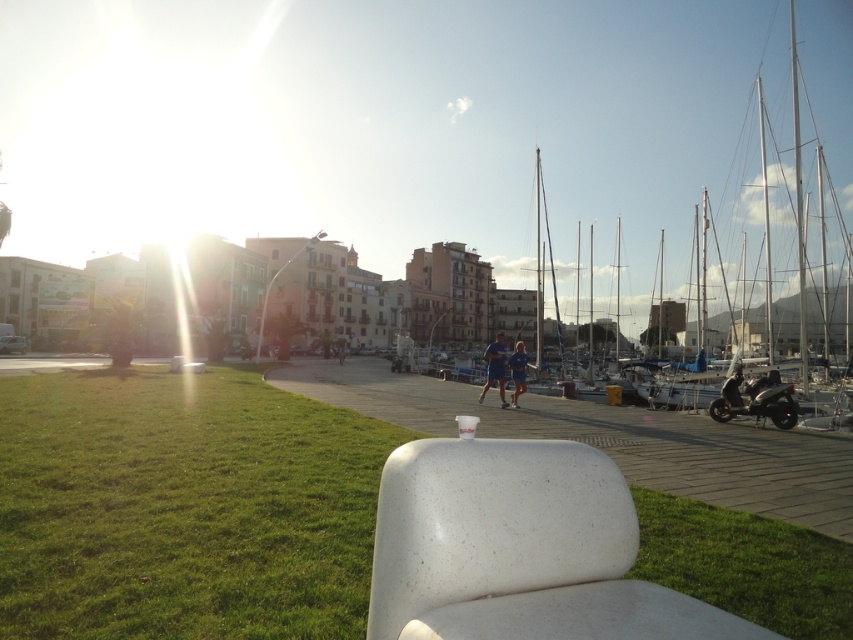
Question: Can you confirm if green grass at lower right is thinner than blue fabric shorts at center?

Choices:
 (A) no
 (B) yes

Answer: (B)

Question: Is green grass at lower left positioned in front of sleek silver motorcycle at lower right?

Choices:
 (A) no
 (B) yes

Answer: (B)

Question: Does white sailboat at center appear under white smooth dock at center?

Choices:
 (A) yes
 (B) no

Answer: (B)

Question: Which point is closer to the camera taking this photo?

Choices:
 (A) (780, 381)
 (B) (515, 362)

Answer: (A)

Question: Which point is closer to the camera?

Choices:
 (A) green grass at lower right
 (B) white speckled plastic chair at center
 (C) sleek silver motorcycle at lower right
 (D) blue fabric shorts at center

Answer: (B)

Question: Which object is the farthest from the blue fabric shirt at center?

Choices:
 (A) white smooth dock at center
 (B) green grass at lower right

Answer: (B)